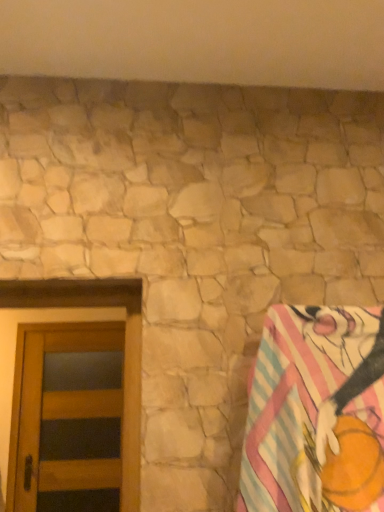
What do you see at coordinates (125, 346) in the screenshot? This screenshot has height=512, width=384. I see `wooden door at left` at bounding box center [125, 346].

Identify the location of wooden door at left. This screenshot has width=384, height=512. (125, 346).

I want to click on wooden door at left, so tap(125, 346).